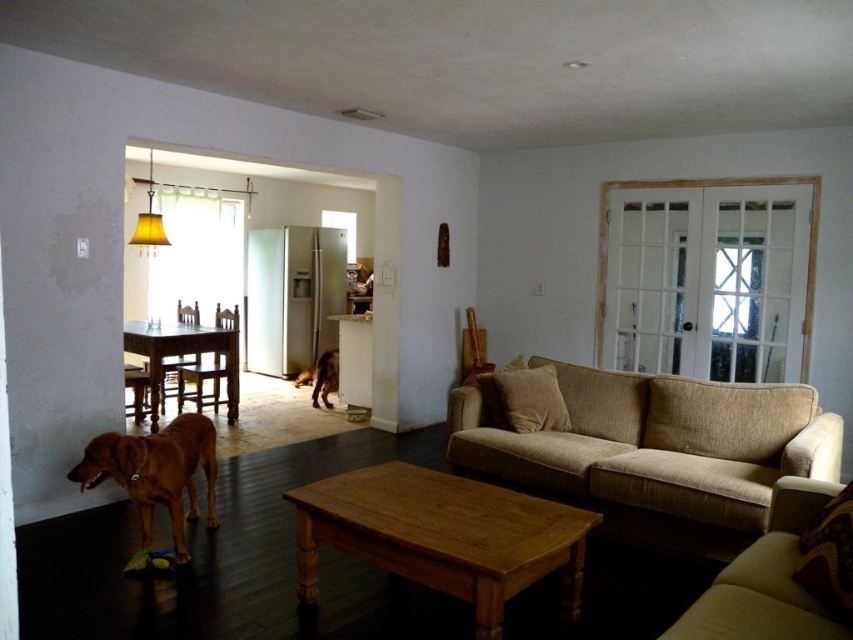
You are sitting on the beige fabric couch at center and want to reach the brown wooden chair at center. Which direction should you move to get closer to the chair?

Since the beige fabric couch at center is located below the brown wooden chair at center, you should move upward to get closer to the chair.

You are standing in the living room and want to take a photo of the dining area through the doorway. There are two points marked in the image at coordinates point (x=218, y=308) and point (x=337, y=356). Which point should you focus on to ensure the dining area is in sharp focus?

You should focus on point (x=218, y=308) because it is closer to the camera than point (x=337, y=356), so it will be in focus when capturing the dining area.